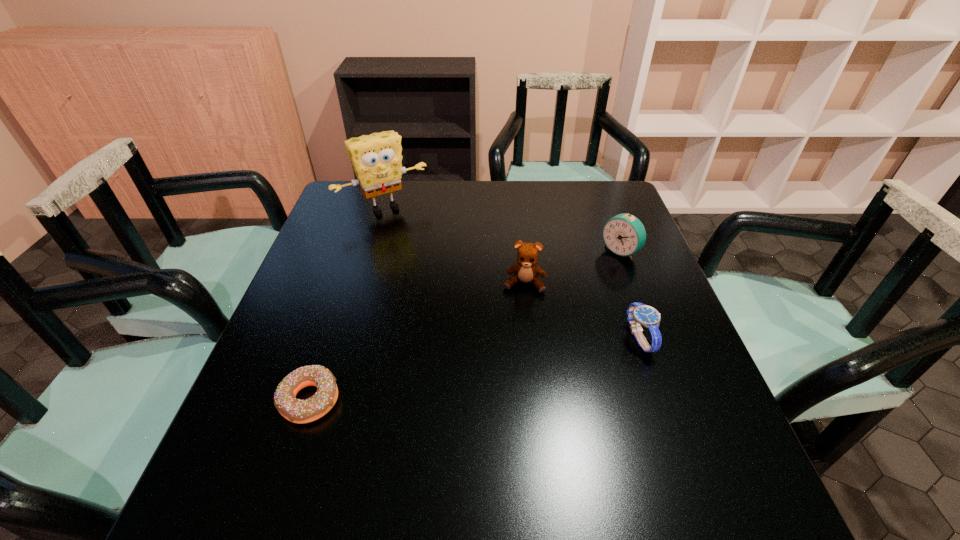
I want to click on vacant space on the desktop that is between the shortest object and the fourth farthest object and is positioned on the front-facing side of the teddy bear, so click(516, 361).

Locate an element on the screen. This screenshot has width=960, height=540. free spot on the desktop that is between the nearest object and the second shortest object and is positioned on the front-facing side of the alarm clock is located at coordinates (466, 370).

You are a GUI agent. You are given a task and a screenshot of the screen. Output one action in this format:
    pyautogui.click(x=<x>, y=<y>)
    Task: Click on the free spot on the desktop that is between the shortest object and the fourth tallest object and is positioned on the face of the tallest object
    
    Given the screenshot: What is the action you would take?
    pyautogui.click(x=497, y=365)